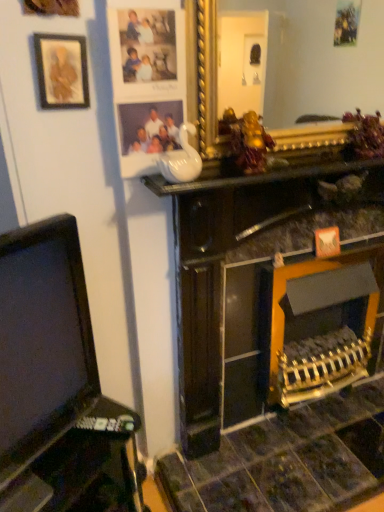
What do you see at coordinates (57, 385) in the screenshot? I see `black plastic tv at left` at bounding box center [57, 385].

Identify the location of white glossy vase at upper center. The height and width of the screenshot is (512, 384). (260, 173).

Identify the location of gold/gilded mirror at upper center. Image resolution: width=384 pixels, height=512 pixels. (320, 67).

You are a GUI agent. You are given a task and a screenshot of the screen. Output one action in this format:
    pyautogui.click(x=<x>, y=<y>)
    Task: Click on the black plastic tv at left
    This screenshot has height=512, width=384.
    Given the screenshot: What is the action you would take?
    pyautogui.click(x=57, y=385)

Is gold/gilded mirror at upper center aimed at white glossy vase at upper center?

Yes, gold/gilded mirror at upper center is turned towards white glossy vase at upper center.

Would you say gold/gilded mirror at upper center is inside or outside white glossy vase at upper center?

gold/gilded mirror at upper center cannot be found inside white glossy vase at upper center.

Considering the relative sizes of gold/gilded mirror at upper center and white glossy vase at upper center in the image provided, is gold/gilded mirror at upper center bigger than white glossy vase at upper center?

Indeed, gold/gilded mirror at upper center has a larger size compared to white glossy vase at upper center.

From a real-world perspective, is gold/gilded mirror at upper center over white glossy vase at upper center?

Yes.

Does matte gold picture frame at upper left, the first picture frame viewed from the left, turn towards black plastic tv at left?

No, matte gold picture frame at upper left, the first picture frame viewed from the left, is not facing towards black plastic tv at left.

Is black plastic tv at left completely or partially inside matte gold picture frame at upper left, the first picture frame viewed from the left?

Definitely not — black plastic tv at left is not inside matte gold picture frame at upper left, the first picture frame viewed from the left.

Measure the distance between matte gold picture frame at upper left, the first picture frame viewed from the left, and black plastic tv at left.

They are 26.34 inches apart.

Which of these two, matte gold picture frame at upper left, the first picture frame viewed from the left, or black plastic tv at left, is smaller?

With smaller size is matte gold picture frame at upper left, the first picture frame viewed from the left.

Considering the positions of points (231, 187) and (44, 94), is point (231, 187) farther from camera compared to point (44, 94)?

That is True.

Is white glossy vase at upper center next to matte gold picture frame at upper left, the first picture frame viewed from the left?

No, white glossy vase at upper center is not with matte gold picture frame at upper left, the first picture frame viewed from the left.

Is white glossy vase at upper center wider or thinner than matte gold picture frame at upper left, which appears as the 2th picture frame when viewed from the right?

Clearly, white glossy vase at upper center has more width compared to matte gold picture frame at upper left, which appears as the 2th picture frame when viewed from the right.

Can you confirm if white glossy vase at upper center is positioned to the left of matte gold picture frame at upper left, which appears as the 2th picture frame when viewed from the right?

Incorrect, white glossy vase at upper center is not on the left side of matte gold picture frame at upper left, which appears as the 2th picture frame when viewed from the right.

Looking at this image, which object is positioned more to the right, matte gold picture frame at upper left, the first picture frame viewed from the left, or matte plastic picture frame at upper center, which is the 2th picture frame from left to right?

From the viewer's perspective, matte plastic picture frame at upper center, which is the 2th picture frame from left to right, appears more on the right side.

From the image's perspective, is matte gold picture frame at upper left, which appears as the 2th picture frame when viewed from the right, located beneath matte plastic picture frame at upper center, which is counted as the 1th picture frame, starting from the right?

Incorrect, from the image's perspective, matte gold picture frame at upper left, which appears as the 2th picture frame when viewed from the right, is higher than matte plastic picture frame at upper center, which is counted as the 1th picture frame, starting from the right.

What are the coordinates of `picture frame that is above the matte plastic picture frame at upper center, which is counted as the 1th picture frame, starting from the right (from a real-world perspective)` in the screenshot? It's located at (62, 71).

Considering the relative sizes of matte gold picture frame at upper left, which appears as the 2th picture frame when viewed from the right, and matte plastic picture frame at upper center, which is counted as the 1th picture frame, starting from the right, in the image provided, is matte gold picture frame at upper left, which appears as the 2th picture frame when viewed from the right, bigger than matte plastic picture frame at upper center, which is counted as the 1th picture frame, starting from the right,?

No, matte gold picture frame at upper left, which appears as the 2th picture frame when viewed from the right, is not bigger than matte plastic picture frame at upper center, which is counted as the 1th picture frame, starting from the right.

Is white glossy vase at upper center in contact with gold/gilded mirror at upper center?

No, white glossy vase at upper center is not touching gold/gilded mirror at upper center.

From their relative heights in the image, would you say white glossy vase at upper center is taller or shorter than gold/gilded mirror at upper center?

In the image, white glossy vase at upper center appears to be shorter than gold/gilded mirror at upper center.

From a real-world perspective, which object stands above the other?

gold/gilded mirror at upper center.

How distant is white glossy vase at upper center from gold/gilded mirror at upper center?

white glossy vase at upper center and gold/gilded mirror at upper center are 10.56 feet apart from each other.

The width and height of the screenshot is (384, 512). Find the location of `furniture in front of the gold/gilded mirror at upper center`. furniture in front of the gold/gilded mirror at upper center is located at coordinates (57, 385).

Would you consider black plastic tv at left to be distant from gold/gilded mirror at upper center?

black plastic tv at left is far away from gold/gilded mirror at upper center.

Does black plastic tv at left have a greater height compared to gold/gilded mirror at upper center?

Indeed, black plastic tv at left has a greater height compared to gold/gilded mirror at upper center.

Can you confirm if matte plastic picture frame at upper center, which is the 2th picture frame from left to right, is wider than gold/gilded mirror at upper center?

No.

This screenshot has width=384, height=512. I want to click on mirror lying behind the matte plastic picture frame at upper center, which is counted as the 1th picture frame, starting from the right, so click(x=320, y=67).

From the image's perspective, which one is positioned lower, matte plastic picture frame at upper center, which is counted as the 1th picture frame, starting from the right, or gold/gilded mirror at upper center?

matte plastic picture frame at upper center, which is counted as the 1th picture frame, starting from the right, is shown below in the image.

Could gold/gilded mirror at upper center be considered to be inside matte plastic picture frame at upper center, which is the 2th picture frame from left to right?

No.

Where is `counter top on the left of gold/gilded mirror at upper center`? The width and height of the screenshot is (384, 512). counter top on the left of gold/gilded mirror at upper center is located at coordinates (260, 173).

Where is `furniture below the matte gold picture frame at upper left, which appears as the 2th picture frame when viewed from the right (from a real-world perspective)`? furniture below the matte gold picture frame at upper left, which appears as the 2th picture frame when viewed from the right (from a real-world perspective) is located at coordinates (57, 385).

Based on the photo, when comparing their distances from white glossy vase at upper center, does matte gold picture frame at upper left, the first picture frame viewed from the left, or matte plastic picture frame at upper center, which is counted as the 1th picture frame, starting from the right, seem further?

Based on the image, matte gold picture frame at upper left, the first picture frame viewed from the left, appears to be further to white glossy vase at upper center.

Considering their positions, is black plastic tv at left positioned closer to gold/gilded mirror at upper center than matte gold picture frame at upper left, which appears as the 2th picture frame when viewed from the right?

matte gold picture frame at upper left, which appears as the 2th picture frame when viewed from the right, is positioned closer to the anchor gold/gilded mirror at upper center.

When comparing their distances from gold/gilded mirror at upper center, does white glossy vase at upper center or black plastic tv at left seem closer?

Among the two, white glossy vase at upper center is located nearer to gold/gilded mirror at upper center.

Based on their spatial positions, is matte gold picture frame at upper left, which appears as the 2th picture frame when viewed from the right, or white glossy vase at upper center closer to matte plastic picture frame at upper center, which is the 2th picture frame from left to right?

matte gold picture frame at upper left, which appears as the 2th picture frame when viewed from the right.

Which object lies further to the anchor point matte gold picture frame at upper left, which appears as the 2th picture frame when viewed from the right, gold/gilded mirror at upper center or black plastic tv at left?

gold/gilded mirror at upper center is further to matte gold picture frame at upper left, which appears as the 2th picture frame when viewed from the right.

When comparing their distances from white glossy vase at upper center, does matte gold picture frame at upper left, the first picture frame viewed from the left, or black plastic tv at left seem further?

Based on the image, black plastic tv at left appears to be further to white glossy vase at upper center.

Based on their spatial positions, is black plastic tv at left or white glossy vase at upper center closer to matte gold picture frame at upper left, which appears as the 2th picture frame when viewed from the right?

The object closer to matte gold picture frame at upper left, which appears as the 2th picture frame when viewed from the right, is white glossy vase at upper center.

Estimate the real-world distances between objects in this image. Which object is further from matte gold picture frame at upper left, the first picture frame viewed from the left, white glossy vase at upper center or gold/gilded mirror at upper center?

The object further to matte gold picture frame at upper left, the first picture frame viewed from the left, is gold/gilded mirror at upper center.

I want to click on counter top between matte plastic picture frame at upper center, which is counted as the 1th picture frame, starting from the right, and gold/gilded mirror at upper center from left to right, so click(260, 173).

Where is `counter top between gold/gilded mirror at upper center and black plastic tv at left in the vertical direction`? This screenshot has height=512, width=384. counter top between gold/gilded mirror at upper center and black plastic tv at left in the vertical direction is located at coordinates (260, 173).

This screenshot has height=512, width=384. In order to click on counter top between matte gold picture frame at upper left, the first picture frame viewed from the left, and gold/gilded mirror at upper center from left to right in this screenshot , I will do `click(260, 173)`.

Image resolution: width=384 pixels, height=512 pixels. In order to click on picture frame between matte gold picture frame at upper left, which appears as the 2th picture frame when viewed from the right, and gold/gilded mirror at upper center in this screenshot , I will do `click(151, 89)`.